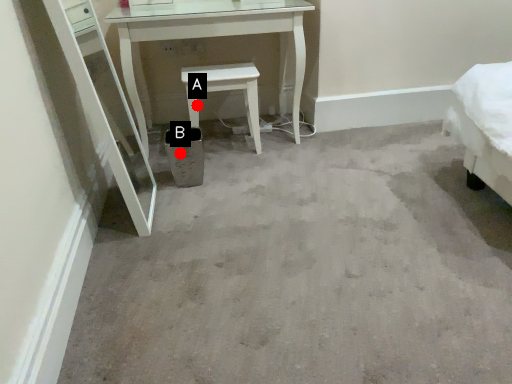
Question: Two points are circled on the image, labeled by A and B beside each circle. Among these points, which one is farthest from the camera?

Choices:
 (A) A is further
 (B) B is further

Answer: (A)